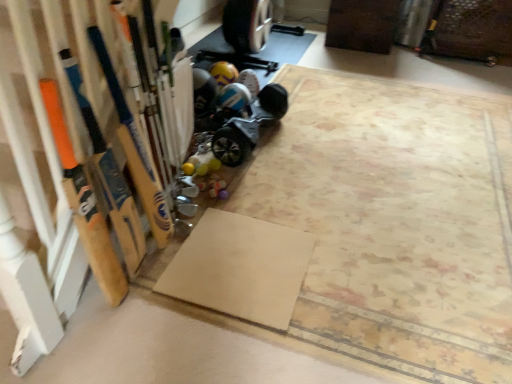
Question: Does blue metallic hoverboard at lower center have a lesser width compared to wooden baseball bat at left, the first baseball bat when ordered from left to right?

Choices:
 (A) no
 (B) yes

Answer: (A)

Question: From the image's perspective, would you say blue metallic hoverboard at lower center is shown under wooden baseball bat at left, which ranks as the 2th baseball bat in right-to-left order?

Choices:
 (A) yes
 (B) no

Answer: (B)

Question: Is blue metallic hoverboard at lower center far away from wooden baseball bat at left, the first baseball bat when ordered from left to right?

Choices:
 (A) no
 (B) yes

Answer: (B)

Question: Considering the relative sizes of blue metallic hoverboard at lower center and wooden baseball bat at left, the first baseball bat when ordered from left to right, in the image provided, is blue metallic hoverboard at lower center taller than wooden baseball bat at left, the first baseball bat when ordered from left to right,?

Choices:
 (A) yes
 (B) no

Answer: (B)

Question: Is blue metallic hoverboard at lower center bigger than wooden baseball bat at left, the first baseball bat when ordered from left to right?

Choices:
 (A) no
 (B) yes

Answer: (B)

Question: From a real-world perspective, is beige matte yoga mat at lower center positioned above or below blue metallic hoverboard at lower center?

Choices:
 (A) below
 (B) above

Answer: (A)

Question: Is beige matte yoga mat at lower center in front of or behind blue metallic hoverboard at lower center in the image?

Choices:
 (A) front
 (B) behind

Answer: (A)

Question: Is beige matte yoga mat at lower center spatially inside blue metallic hoverboard at lower center, or outside of it?

Choices:
 (A) outside
 (B) inside

Answer: (A)

Question: Would you say beige matte yoga mat at lower center is to the left or to the right of blue metallic hoverboard at lower center in the picture?

Choices:
 (A) left
 (B) right

Answer: (A)

Question: Is blue metallic hoverboard at lower center inside or outside of beige matte yoga mat at lower center?

Choices:
 (A) inside
 (B) outside

Answer: (B)

Question: Would you say blue metallic hoverboard at lower center is to the left or to the right of beige matte yoga mat at lower center in the picture?

Choices:
 (A) right
 (B) left

Answer: (A)

Question: Is blue metallic hoverboard at lower center in front of or behind beige matte yoga mat at lower center in the image?

Choices:
 (A) behind
 (B) front

Answer: (A)

Question: In terms of width, does blue metallic hoverboard at lower center look wider or thinner when compared to beige matte yoga mat at lower center?

Choices:
 (A) wide
 (B) thin

Answer: (B)

Question: Considering the positions of wooden baseball bat at left, which ranks as the 2th baseball bat in right-to-left order, and beige matte yoga mat at lower center in the image, is wooden baseball bat at left, which ranks as the 2th baseball bat in right-to-left order, taller or shorter than beige matte yoga mat at lower center?

Choices:
 (A) tall
 (B) short

Answer: (A)

Question: Considering the positions of wooden baseball bat at left, which ranks as the 2th baseball bat in right-to-left order, and beige matte yoga mat at lower center in the image, is wooden baseball bat at left, which ranks as the 2th baseball bat in right-to-left order, wider or thinner than beige matte yoga mat at lower center?

Choices:
 (A) thin
 (B) wide

Answer: (A)